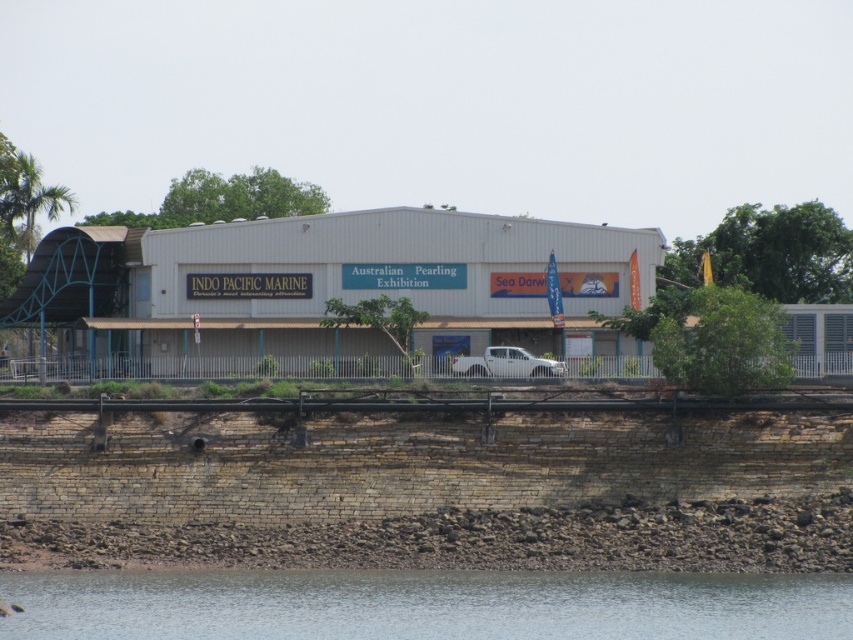
Does clear water at lower center have a lesser height compared to white matte truck at center?

Correct, clear water at lower center is not as tall as white matte truck at center.

What do you see at coordinates (422, 604) in the screenshot?
I see `clear water at lower center` at bounding box center [422, 604].

Does point (730, 636) come behind point (496, 349)?

No, (730, 636) is closer to viewer.

What are the coordinates of `clear water at lower center` in the screenshot? It's located at (422, 604).